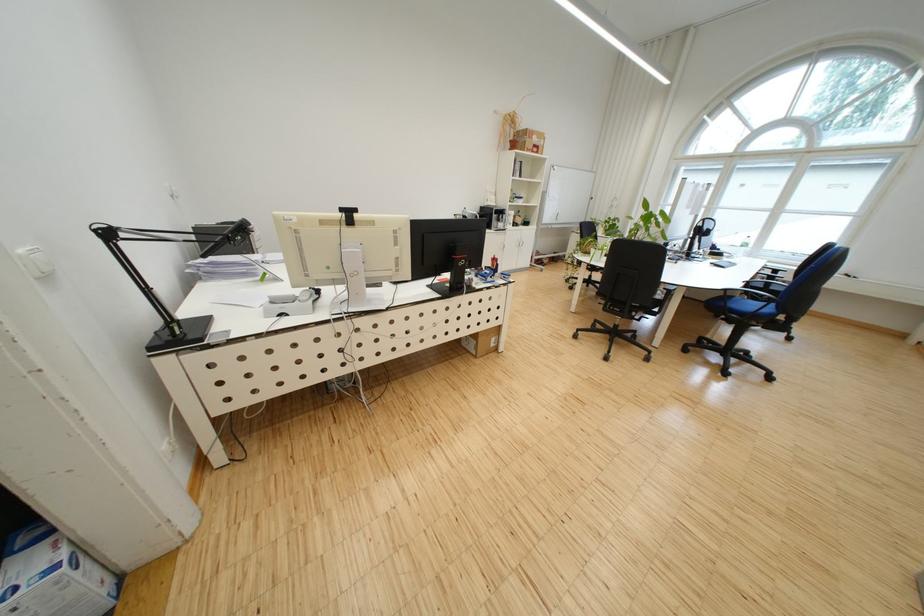
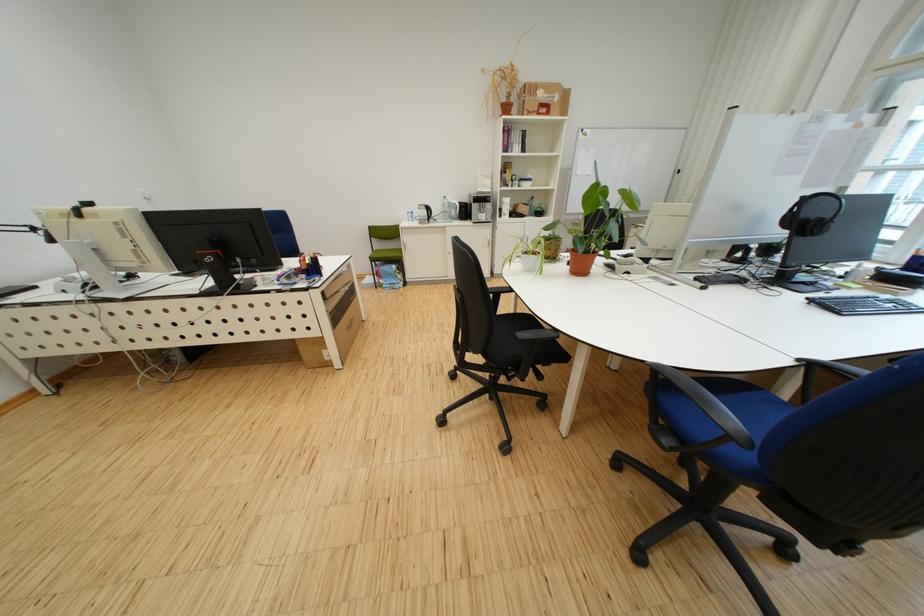
Locate, in the second image, the point that corresponds to (540,152) in the first image.

(541, 115)